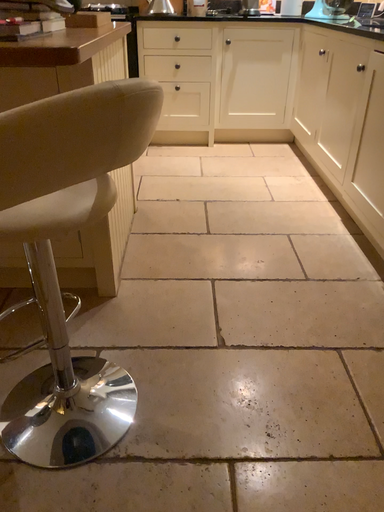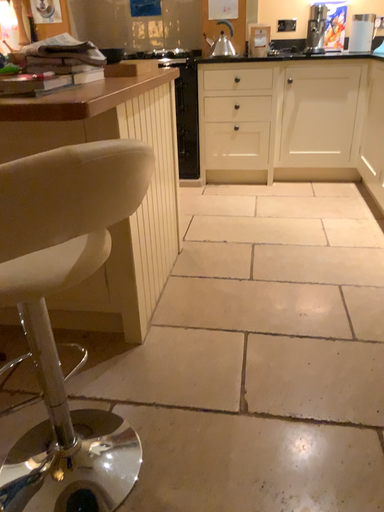
Question: How did the camera likely rotate when shooting the video?

Choices:
 (A) rotated right
 (B) rotated left

Answer: (B)